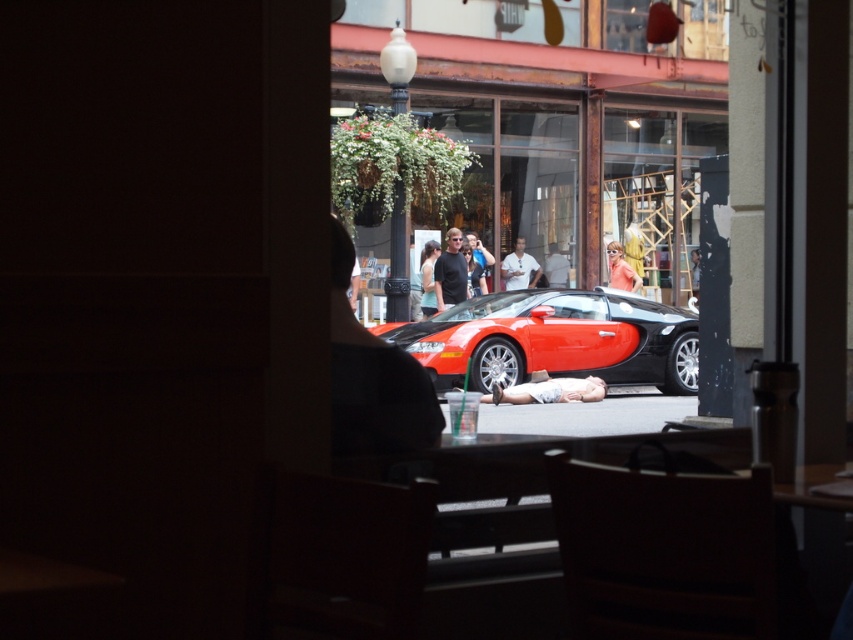
In the scene shown: You are standing inside a dimly lit establishment, possibly a cafe or restaurant, looking out through the window. You notice a point marked at coordinates (426, 272). Considering your current position, is this point closer to you or farther away than 50 feet?

The distance between the point (426, 272) and the camera is 51.97 feet, so the point is farther away than 50 feet.